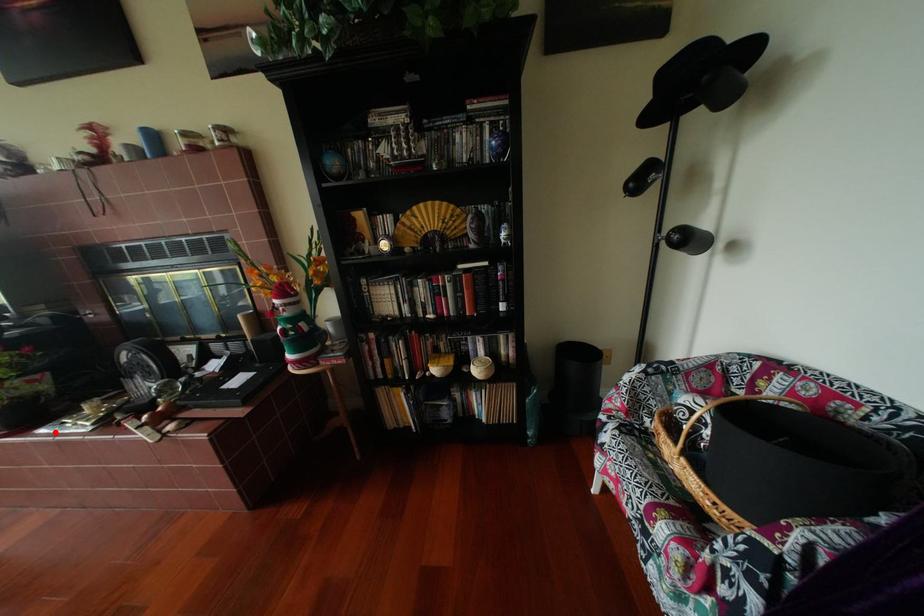
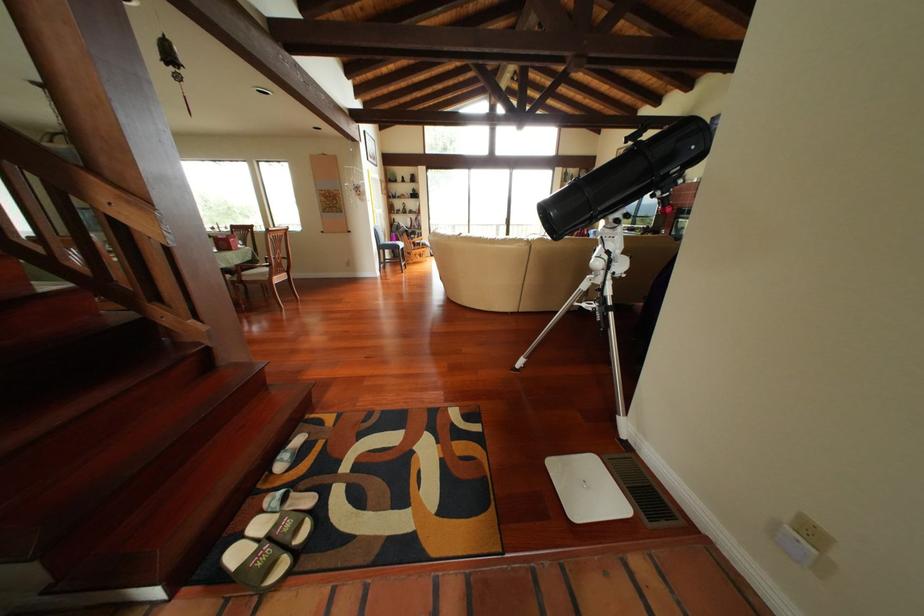
Question: I am providing you with two images of the same scene from different viewpoints. A red point is marked on the first image. At the location where the point appears in image 1, is it still visible in image 2?

Choices:
 (A) Yes
 (B) No

Answer: (B)